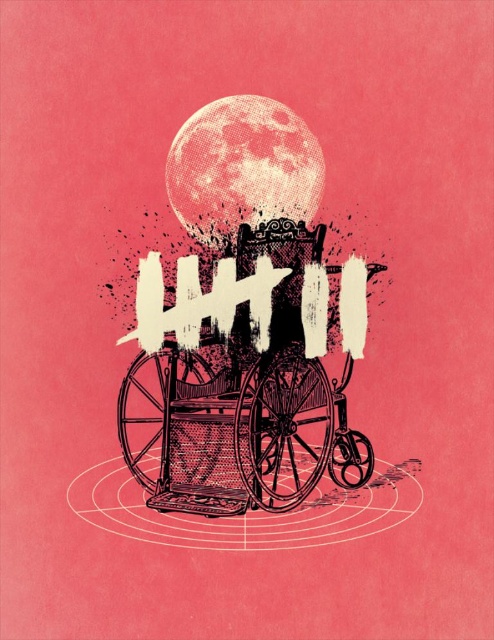
You are an artist analyzing the composition of this image. You notice two specific points marked at coordinates point (123, 396) and point (201, 138). Which of these points is positioned closer to the viewer in the 3D space of the artwork?

Point (123, 396) is closer to the viewer than point (201, 138).

You are an artist trying to draw the scene described. You want to ensure the black ink baby carriage at center and the speckled pink moon at upper center are proportionate. Based on the scene description, which object should you draw larger?

The black ink baby carriage at center should be drawn larger because it is much taller than the speckled pink moon at upper center according to the description.

In the scene shown: You are a photographer standing at a certain distance from the black ink baby carriage at center. You want to take a closeup shot of it without using a zoom lens. What should you do?

Answer: To take a closeup shot of the black ink baby carriage at center without a zoom lens, you should move closer to it since it is currently 2.47 meters away from the camera. Reducing the distance will allow you to capture a closer view.